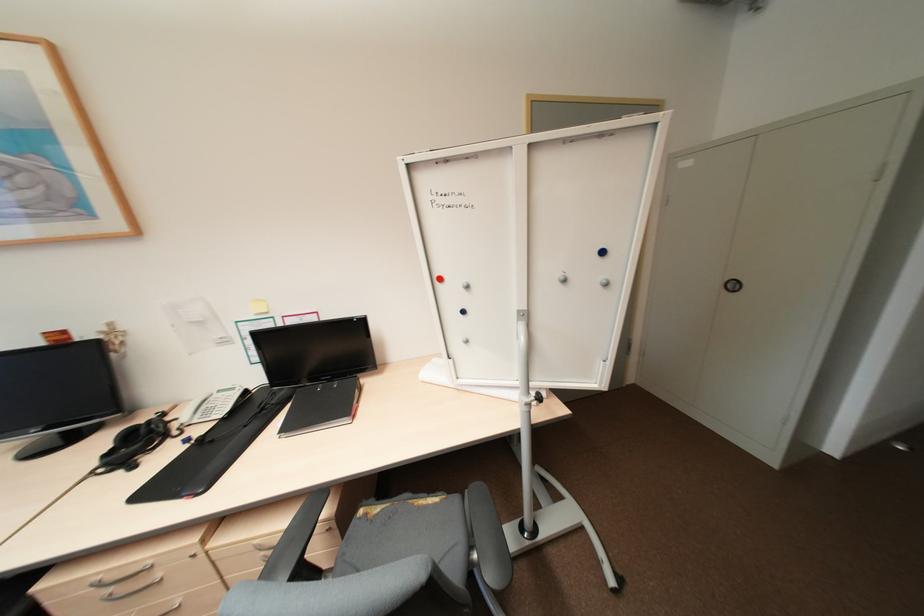
Find where to lift the blue magnet. Please return your answer as a coordinate pair (x, y).

(602, 252)